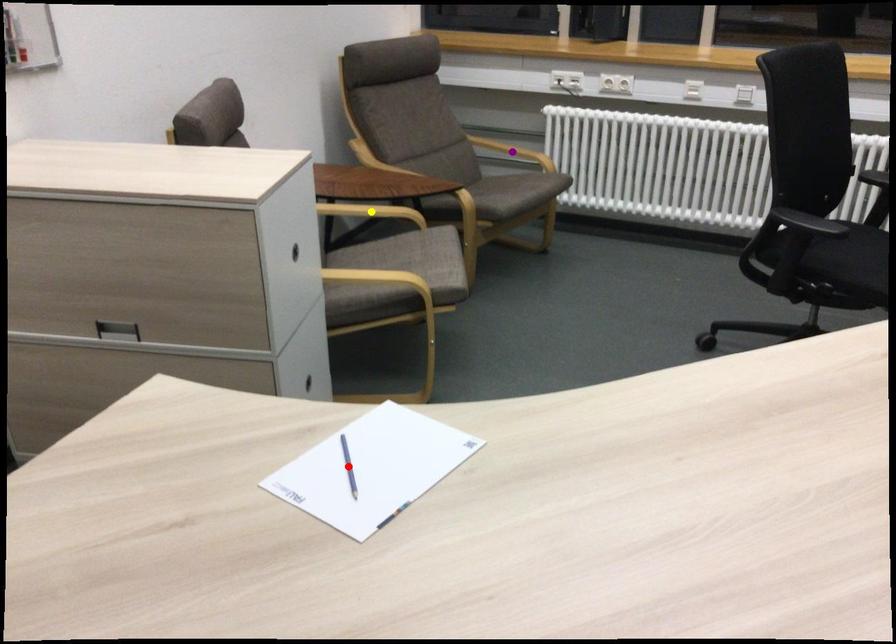
Order these from nearest to farthest:
A) yellow point
B) purple point
C) red point

red point < yellow point < purple point